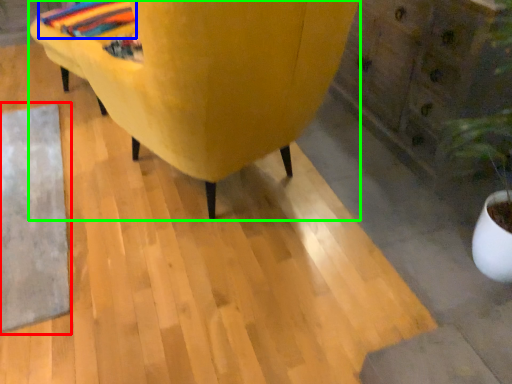
Question: Considering the real-world distances, which object is closest to mat (highlighted by a red box)? blanket (highlighted by a blue box) or furniture (highlighted by a green box).

Choices:
 (A) blanket
 (B) furniture

Answer: (B)